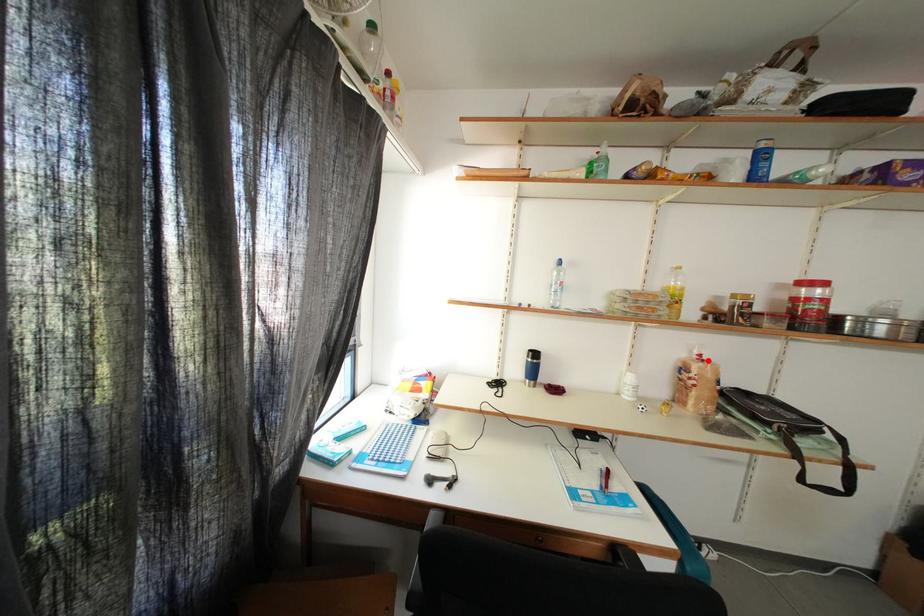
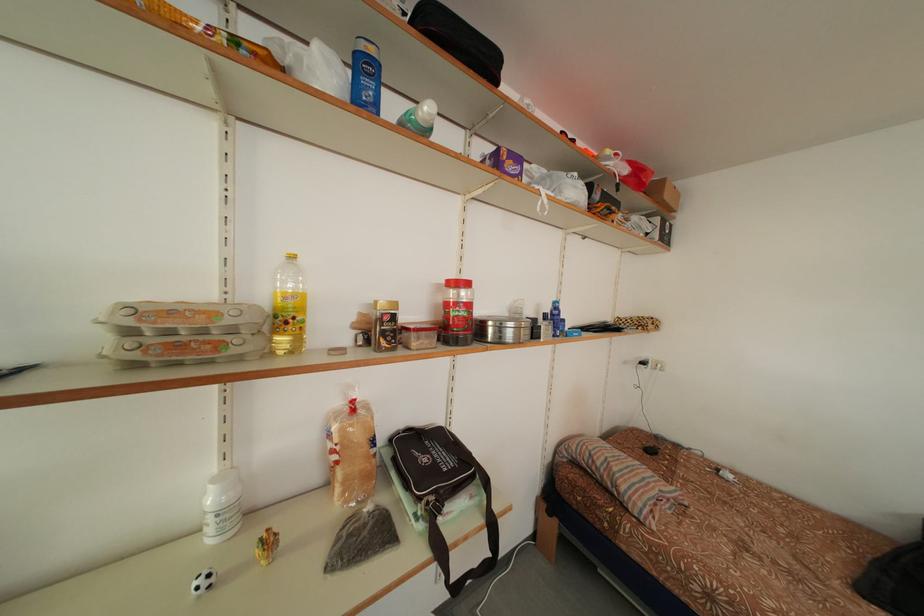
Question: I am providing you with two images of the same scene from different viewpoints. A red point is marked on the first image. Is the red point's position out of view in image 2?

Choices:
 (A) Yes
 (B) No

Answer: (B)